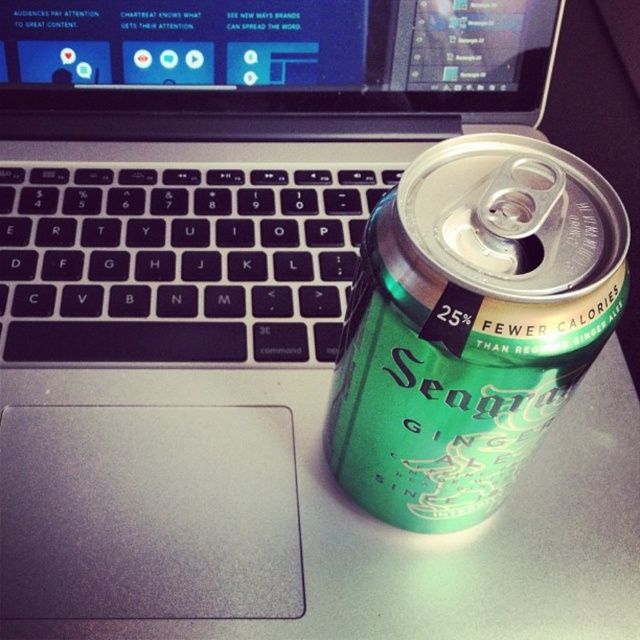
You need to place a 25 cm long ruler between the green metallic can at right and the black matte keyboard at left. Can the ruler fit entirely between them without overlapping either object?

The green metallic can at right and black matte keyboard at left are 25.42 centimeters apart from each other. Since the ruler is 25 cm long, it can fit entirely between them without overlapping either object because the distance between the objects is slightly larger than the ruler.

You are organizing items on a desk and need to stack the green metallic can at right and the black matte keyboard at left. Since you want the taller item on the bottom for stability, which object should you place first?

The green metallic can at right is taller than the black matte keyboard at left, so you should place the green metallic can at right first to ensure stability.